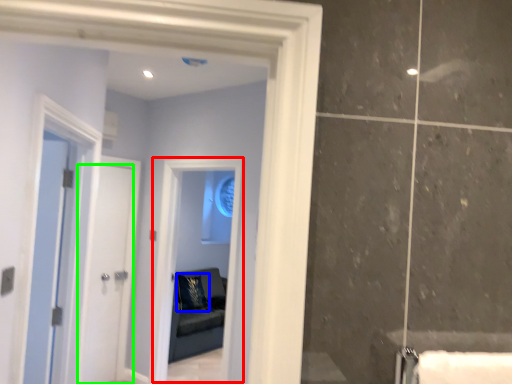
Question: Which is farther away from window (highlighted by a red box)? pillow (highlighted by a blue box) or door (highlighted by a green box)?

Choices:
 (A) pillow
 (B) door

Answer: (A)